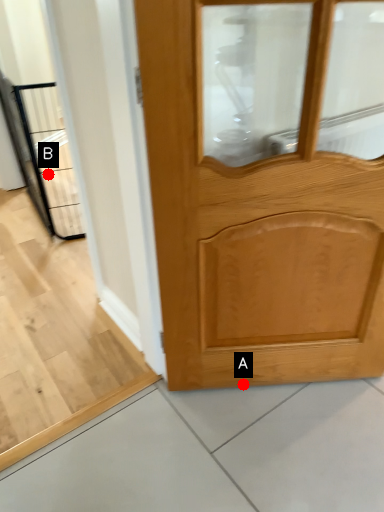
Question: Two points are circled on the image, labeled by A and B beside each circle. Which point appears farthest from the camera in this image?

Choices:
 (A) A is further
 (B) B is further

Answer: (B)